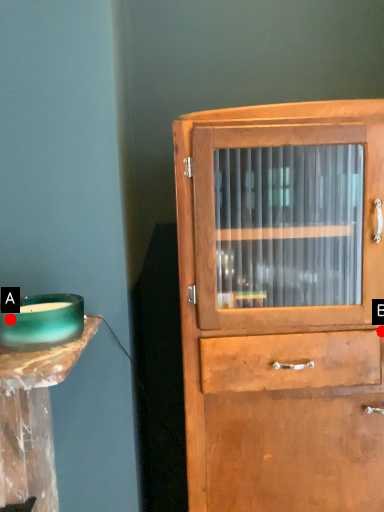
Question: Two points are circled on the image, labeled by A and B beside each circle. Which point appears closest to the camera in this image?

Choices:
 (A) A is closer
 (B) B is closer

Answer: (A)